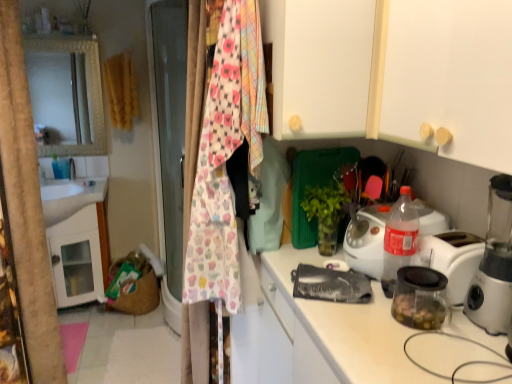
Question: Should I look upward or downward to see yellow fabric clothesline at upper left, the 1th clothesline in the left-to-right sequence?

Choices:
 (A) down
 (B) up

Answer: (B)

Question: Can you confirm if yellow fabric clothesline at upper left, marked as the first clothesline in a top-to-bottom arrangement, is smaller than white glossy sink at left?

Choices:
 (A) no
 (B) yes

Answer: (B)

Question: Is yellow fabric clothesline at upper left, acting as the 2th clothesline starting from the front, oriented away from white glossy sink at left?

Choices:
 (A) no
 (B) yes

Answer: (A)

Question: Does yellow fabric clothesline at upper left, which appears as the second clothesline when viewed from the right, come behind white glossy sink at left?

Choices:
 (A) no
 (B) yes

Answer: (B)

Question: From a real-world perspective, is yellow fabric clothesline at upper left, acting as the 2th clothesline starting from the front, below white glossy sink at left?

Choices:
 (A) no
 (B) yes

Answer: (A)

Question: Is the depth of yellow fabric clothesline at upper left, acting as the 2th clothesline starting from the front, less than that of white glossy sink at left?

Choices:
 (A) no
 (B) yes

Answer: (A)

Question: From a real-world perspective, is yellow fabric clothesline at upper left, acting as the 2th clothesline starting from the front, on top of white glossy sink at left?

Choices:
 (A) no
 (B) yes

Answer: (B)

Question: Is white matte cabinet at upper center behind transparent glass jar at right?

Choices:
 (A) yes
 (B) no

Answer: (A)

Question: From a real-world perspective, is white matte cabinet at upper center physically above transparent glass jar at right?

Choices:
 (A) no
 (B) yes

Answer: (B)

Question: From a real-world perspective, is white matte cabinet at upper center under transparent glass jar at right?

Choices:
 (A) yes
 (B) no

Answer: (B)

Question: Can you confirm if white matte cabinet at upper center is taller than transparent glass jar at right?

Choices:
 (A) no
 (B) yes

Answer: (B)

Question: Does white matte cabinet at upper center come in front of transparent glass jar at right?

Choices:
 (A) no
 (B) yes

Answer: (A)

Question: Is white matte cabinet at upper center far from transparent glass jar at right?

Choices:
 (A) yes
 (B) no

Answer: (B)

Question: Does transparent plastic blender at right have a smaller size compared to white glossy sink at left?

Choices:
 (A) yes
 (B) no

Answer: (A)